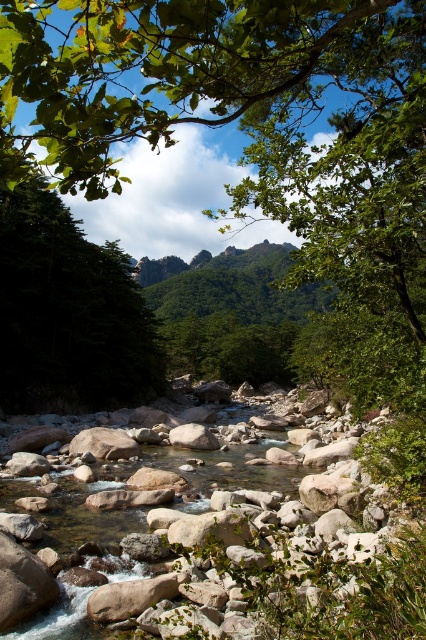
Can you confirm if green leafy tree at upper center is wider than green matte tree at left?

Correct, the width of green leafy tree at upper center exceeds that of green matte tree at left.

Does green leafy tree at upper center have a lesser width compared to green matte tree at left?

No.

Is point (117, 60) positioned before point (51, 394)?

Yes, it is in front of point (51, 394).

Where is `green leafy tree at upper center`? green leafy tree at upper center is located at coordinates (187, 72).